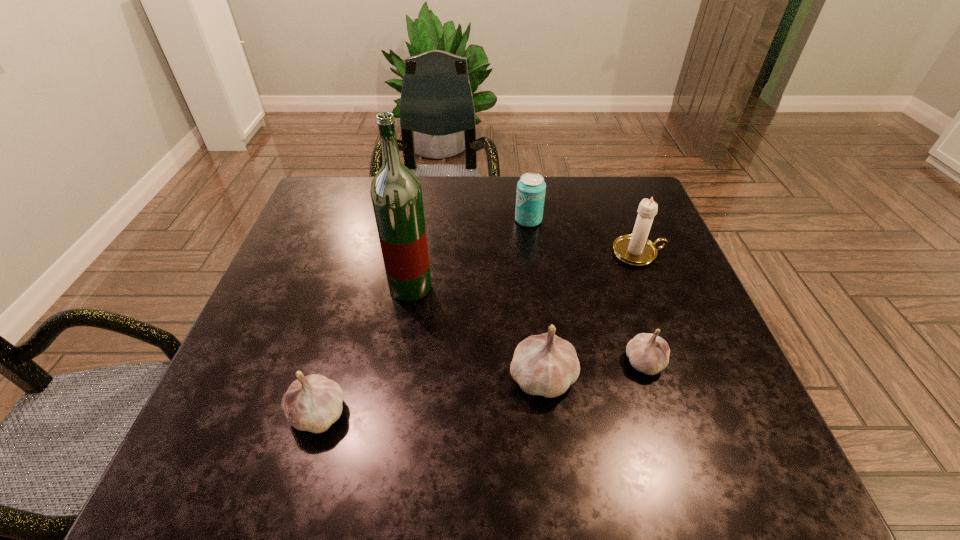
Find the location of a particular element. The height and width of the screenshot is (540, 960). blank region between the farthest object and the fifth object from right to left is located at coordinates (469, 254).

Locate an element on the screen. The image size is (960, 540). empty location between the shortest object and the beer can is located at coordinates (587, 291).

This screenshot has width=960, height=540. Identify the location of vacant area that lies between the shortest object and the candle holder. (641, 307).

This screenshot has height=540, width=960. I want to click on free space that is in between the farthest object and the leftmost object, so click(423, 316).

Where is `free spot between the tallest object and the shortest object`? free spot between the tallest object and the shortest object is located at coordinates (528, 325).

Find the location of `object that is the closest to the rightmost garlic`. object that is the closest to the rightmost garlic is located at coordinates (546, 365).

Locate an element on the screen. This screenshot has height=540, width=960. object that is the fifth closest to the tallest garlic is located at coordinates (531, 188).

In order to click on garlic object that ranks as the third closest to the beer can in this screenshot , I will do pyautogui.click(x=313, y=403).

This screenshot has height=540, width=960. Find the location of `the closest garlic to the tallest garlic`. the closest garlic to the tallest garlic is located at coordinates (648, 353).

You are a GUI agent. You are given a task and a screenshot of the screen. Output one action in this format:
    pyautogui.click(x=<x>, y=<y>)
    Task: Click on the free region that satisfies the following two spatial constraints: 1. on the back side of the tallest garlic; 2. on the left side of the farthest object
    This screenshot has height=540, width=960.
    Given the screenshot: What is the action you would take?
    pyautogui.click(x=524, y=220)